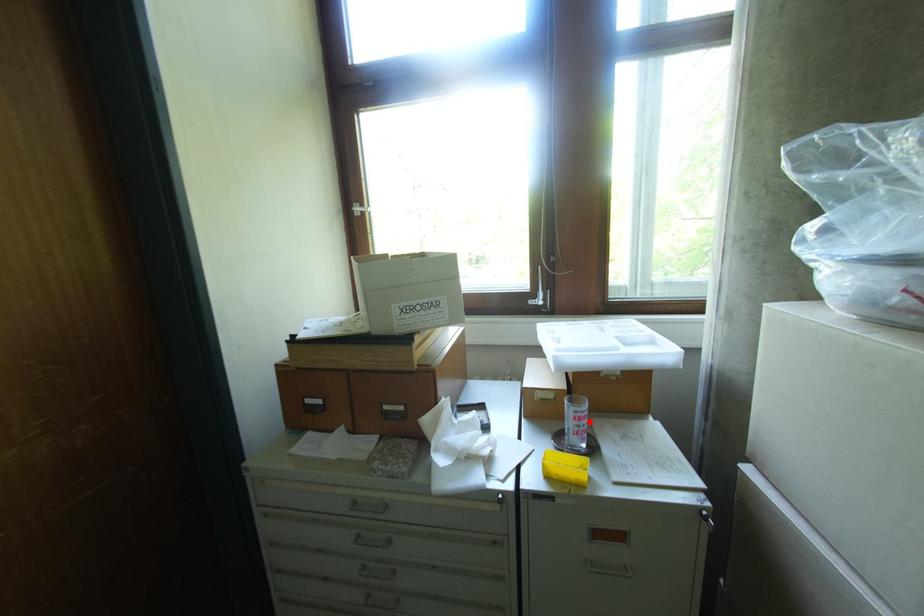
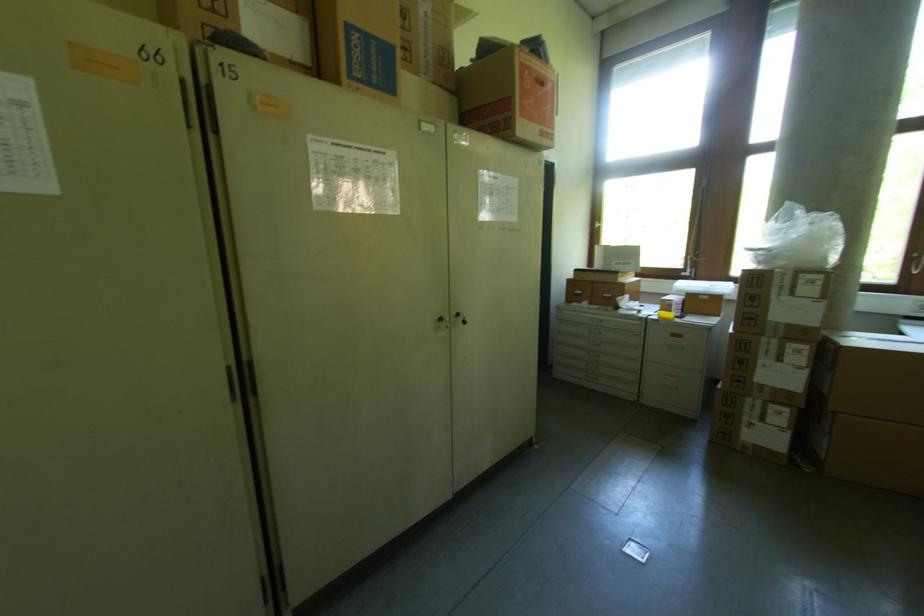
Question: I am providing you with two images of the same scene from different viewpoints. Image1 has a red point marked. In image2, the corresponding 3D location appears at what relative position? Reply with the corresponding letter.

Choices:
 (A) Closer
 (B) Farther

Answer: (A)